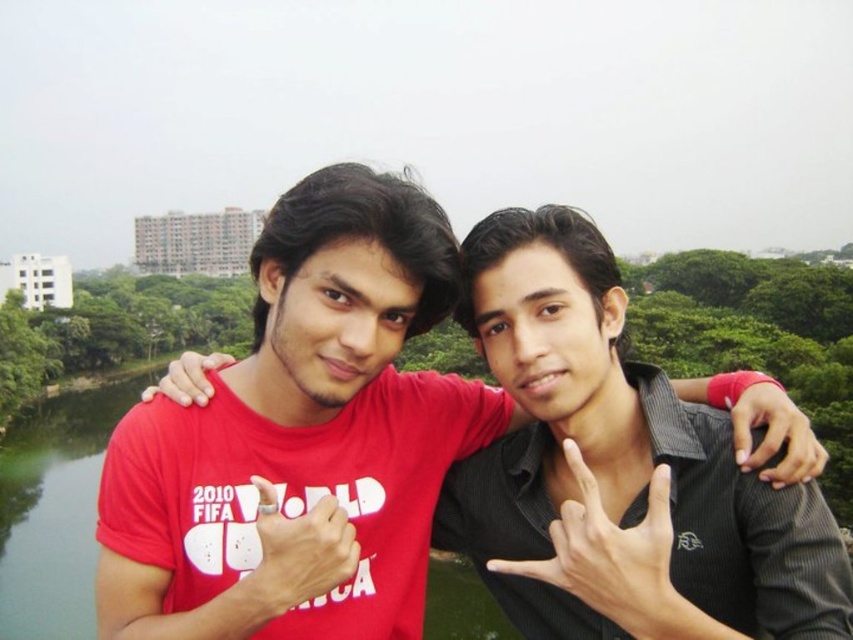
Does matte red t-shirt at center have a larger size compared to black matte shirt at center?

Yes.

Can you confirm if matte red t-shirt at center is positioned above black matte shirt at center?

Yes, matte red t-shirt at center is above black matte shirt at center.

Which is in front, point (425, 545) or point (663, 456)?

Point (663, 456) is in front.

Image resolution: width=853 pixels, height=640 pixels. I want to click on matte red t-shirt at center, so click(x=300, y=440).